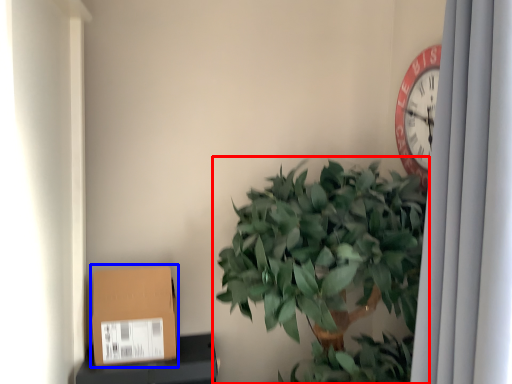
Question: Which object appears closest to the camera in this image, houseplant (highlighted by a red box) or cardboard box (highlighted by a blue box)?

Choices:
 (A) houseplant
 (B) cardboard box

Answer: (A)